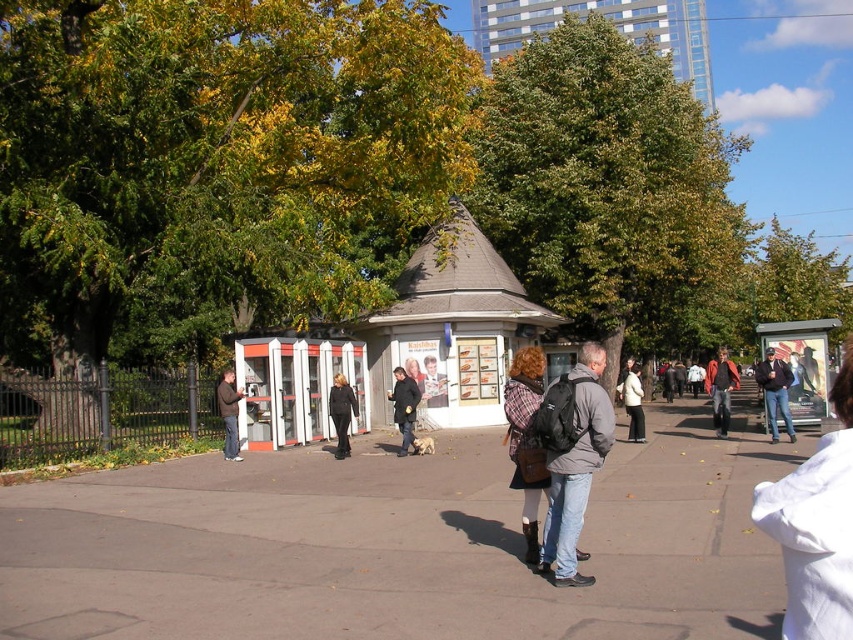
Question: Can you confirm if green leafy tree at upper left is smaller than dark brown leather jacket at left?

Choices:
 (A) yes
 (B) no

Answer: (B)

Question: Which of the following is the closest to the observer?

Choices:
 (A) (426, 372)
 (B) (490, 268)
 (C) (308, 346)
 (D) (573, 572)

Answer: (D)

Question: Does brown asphalt at center appear under plaid fabric coat at center?

Choices:
 (A) no
 (B) yes

Answer: (B)

Question: Is dark brown leather jacket at center in front of dark brown leather jacket at left?

Choices:
 (A) yes
 (B) no

Answer: (B)

Question: Which object appears farthest from the camera in this image?

Choices:
 (A) dark brown leather jacket at left
 (B) plaid fabric jacket at center

Answer: (B)

Question: Which of the following is the farthest from the observer?

Choices:
 (A) brown asphalt at center
 (B) leather jacket at center

Answer: (B)